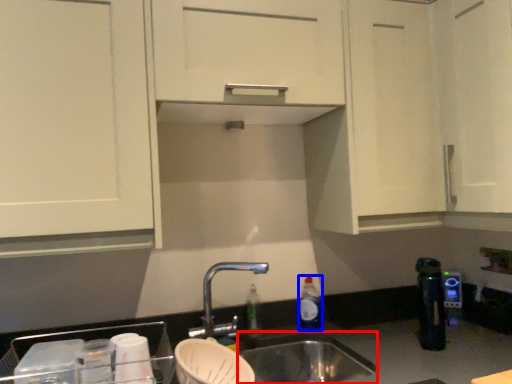
Question: Which of the following is the farthest to the observer, sink (highlighted by a red box) or bottle (highlighted by a blue box)?

Choices:
 (A) sink
 (B) bottle

Answer: (B)